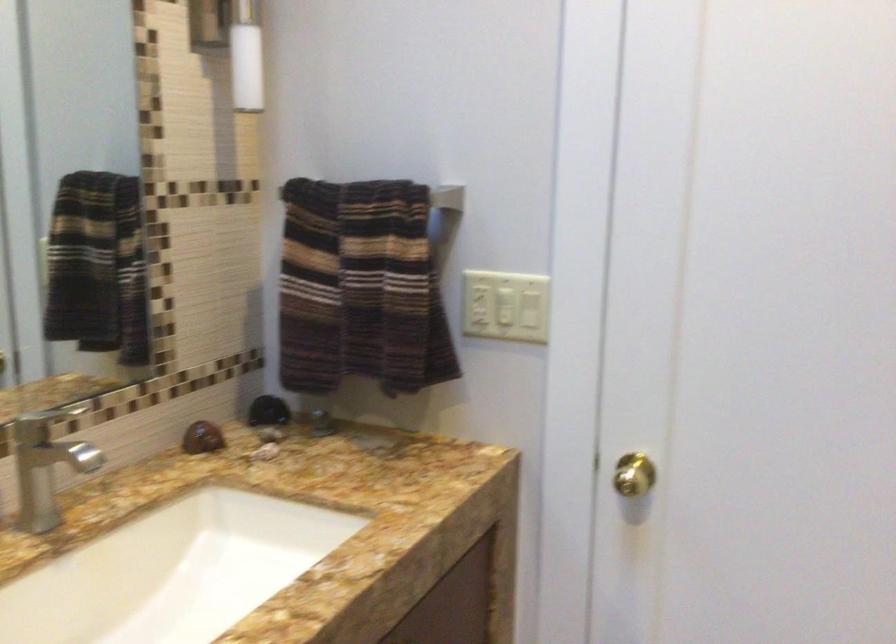
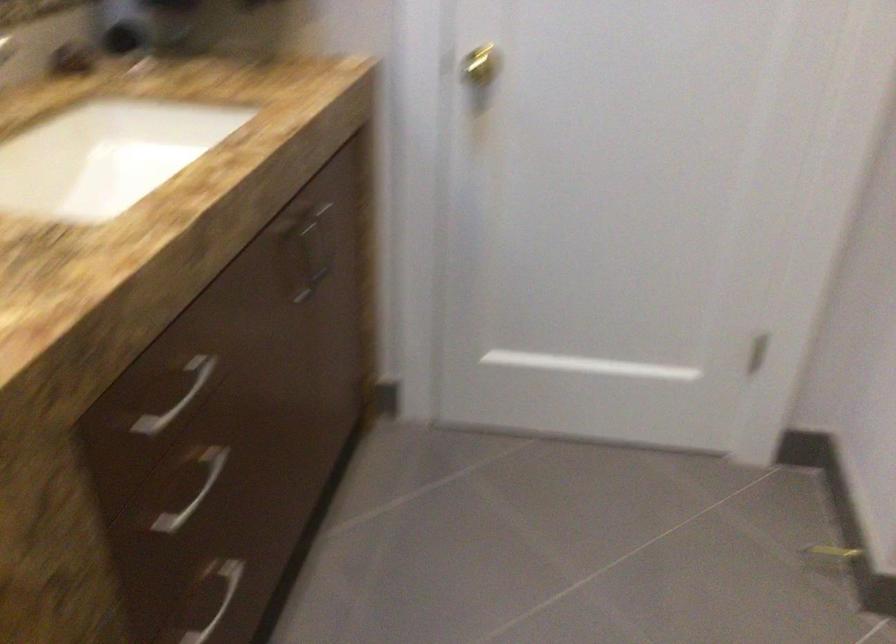
The images are taken continuously from a first-person perspective. In which direction are you moving?

The cameraman moved toward left, backward.